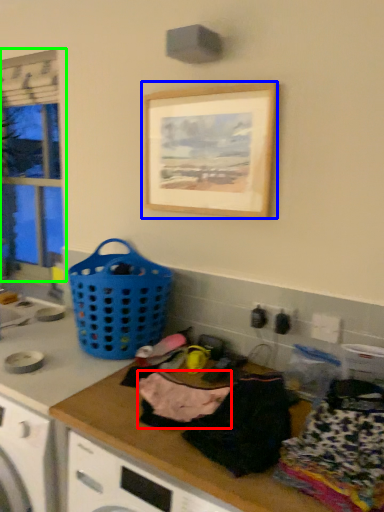
Question: Which object is the farthest from clothing (highlighted by a red box)? Choose among these: picture frame (highlighted by a blue box) or window (highlighted by a green box).

Choices:
 (A) picture frame
 (B) window

Answer: (B)